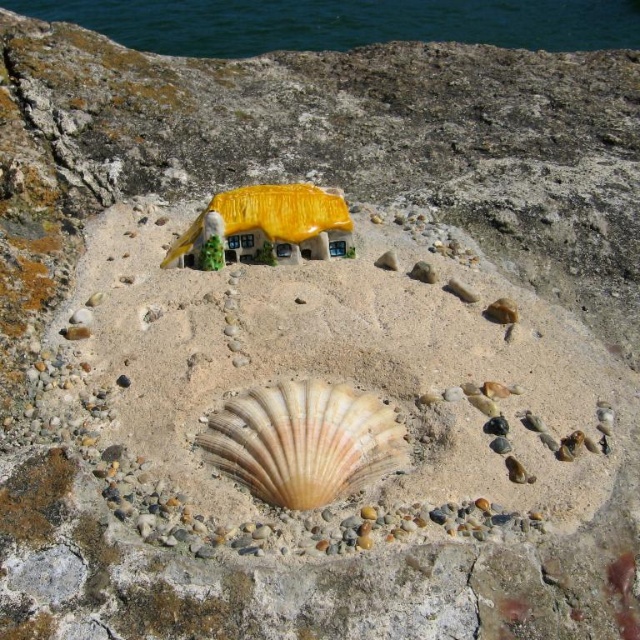
You are a tiny explorer standing at the viewpoint of the image. You see two points in the scene, point 1 at coordinates point (337, 29) and point 2 at coordinates point (276, 461). Which point is closer to you?

Point (337, 29) is further to the viewer than point (276, 461), so point (276, 461) is closer to you.

Based on the photo, you are a tiny explorer standing at the beige scallop shell at center. You want to reach the blue water at upper center. Which direction should you move to get there?

The blue water at upper center is to the right of the beige scallop shell at center, so you should move to the right to reach it.